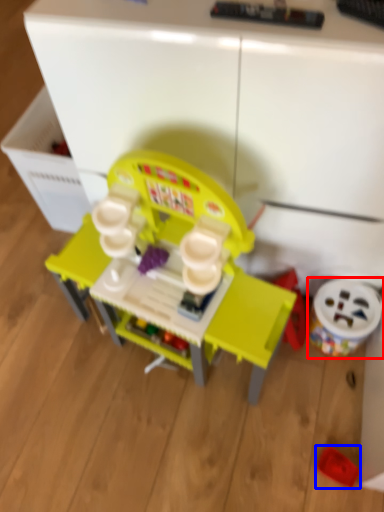
Question: Which of the following is the closest to the observer, toy (highlighted by a red box) or toy (highlighted by a blue box)?

Choices:
 (A) toy
 (B) toy

Answer: (B)